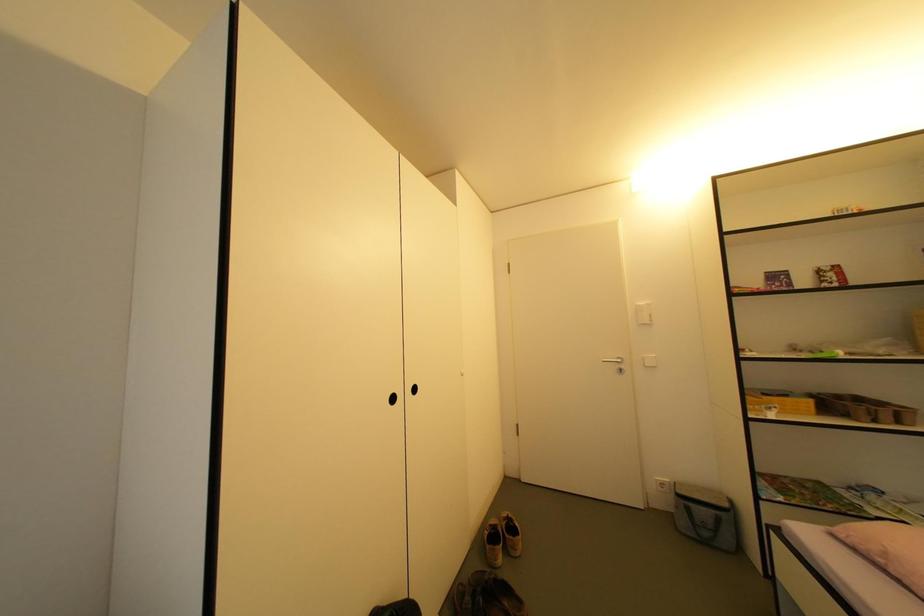
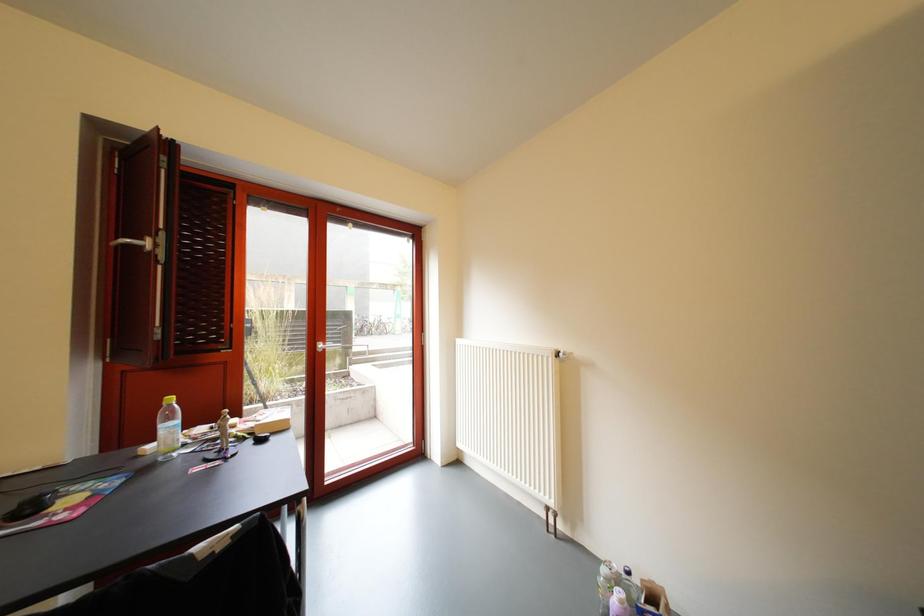
Question: Based on the continuous images, in which direction is the camera rotating? Reply with the corresponding letter.

Choices:
 (A) Left
 (B) Right
 (C) Up
 (D) Down

Answer: (A)